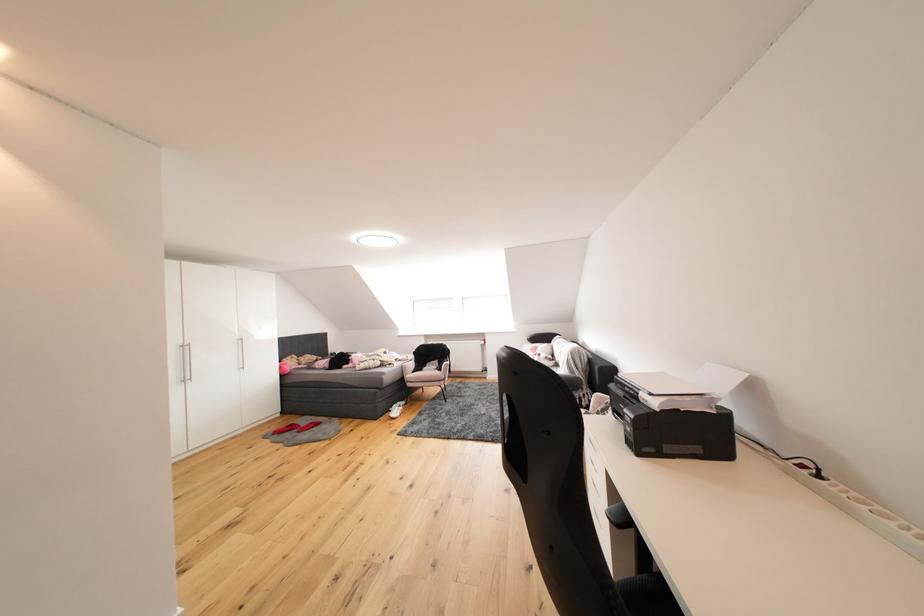
The width and height of the screenshot is (924, 616). Identify the location of pink chair sitting surface. pos(424,378).